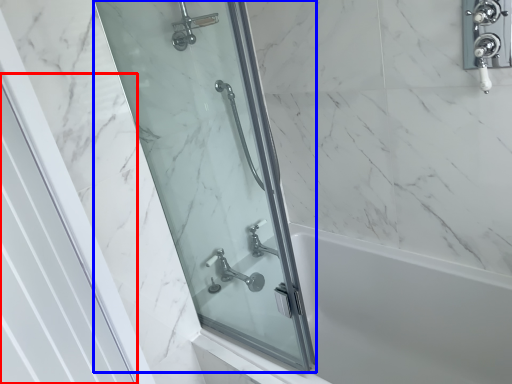
Question: Which point is closer to the camera, screen door (highlighted by a red box) or screen door (highlighted by a blue box)?

Choices:
 (A) screen door
 (B) screen door

Answer: (A)